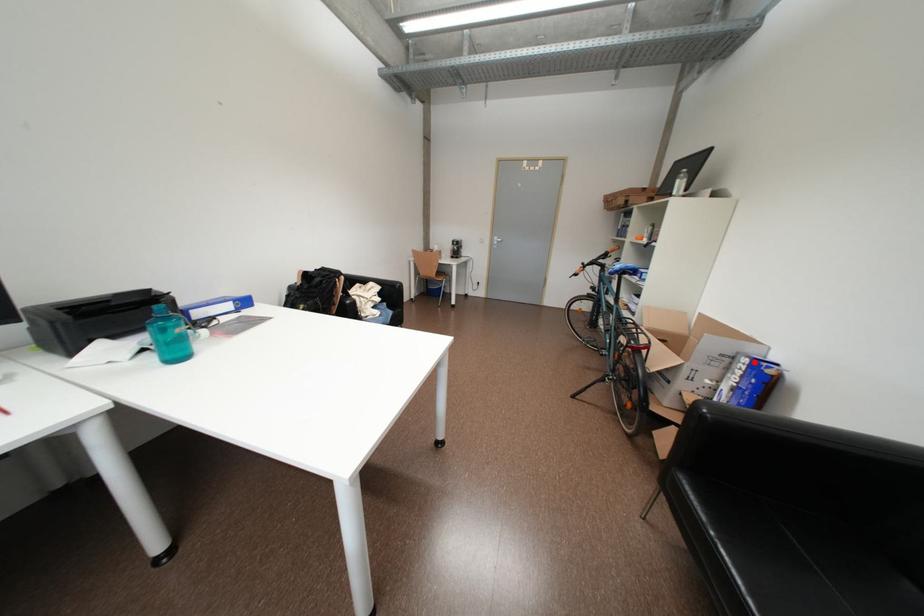
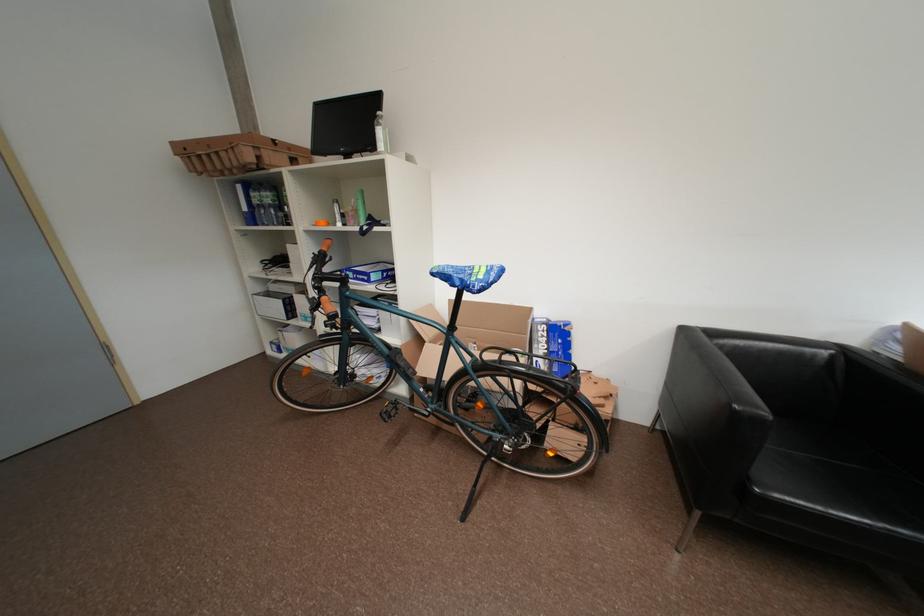
The point at the highlighted location is marked in the first image. Where is the corresponding point in the second image?

(553, 329)